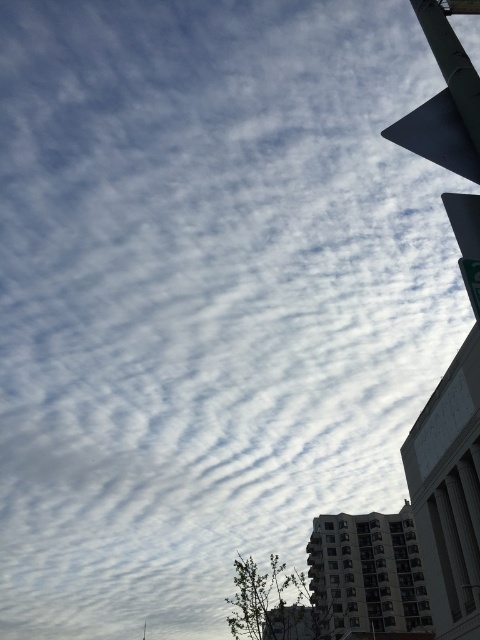
You are a driver approaching an intersection and see the green matte traffic light at upper right and the green metallic pole at upper right. Which object appears bigger in the scene?

The green matte traffic light at upper right is larger in size than the green metallic pole at upper right, so the traffic light appears bigger.